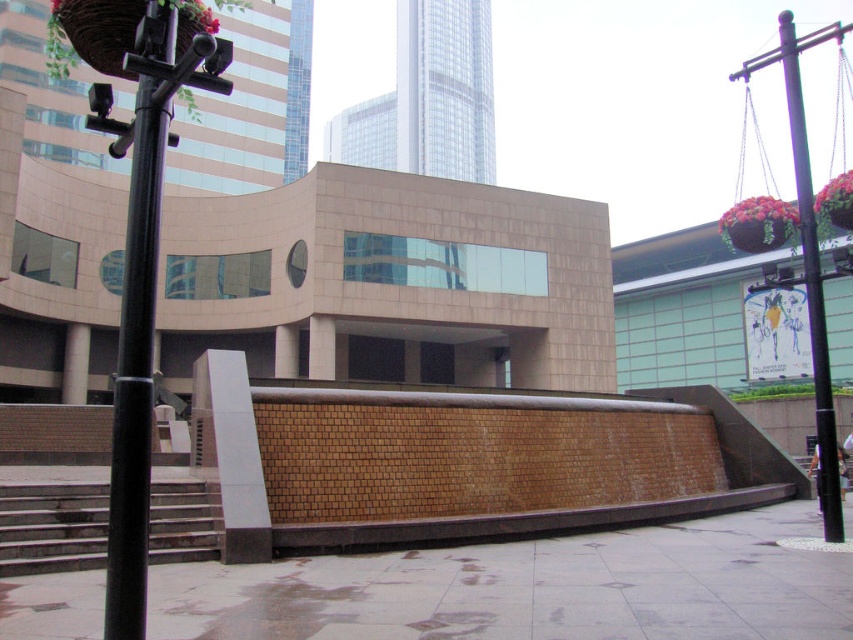
Question: Among these points, which one is farthest from the camera?

Choices:
 (A) (554, 561)
 (B) (155, 28)
 (C) (816, 257)

Answer: (C)

Question: Which point is closer to the camera?

Choices:
 (A) (128, 305)
 (B) (796, 45)

Answer: (A)

Question: Is brown concrete pavement at center thinner than concrete stairs at lower left?

Choices:
 (A) yes
 (B) no

Answer: (B)

Question: Where is black metal pole at left located in relation to concrete stairs at lower left in the image?

Choices:
 (A) below
 (B) above

Answer: (B)

Question: Considering the real-world distances, which object is closest to the concrete stairs at lower left?

Choices:
 (A) black metal pole at right
 (B) black metal pole at left
 (C) brown concrete pavement at center

Answer: (C)

Question: Can you confirm if brown concrete pavement at center is bigger than black metal pole at left?

Choices:
 (A) yes
 (B) no

Answer: (B)